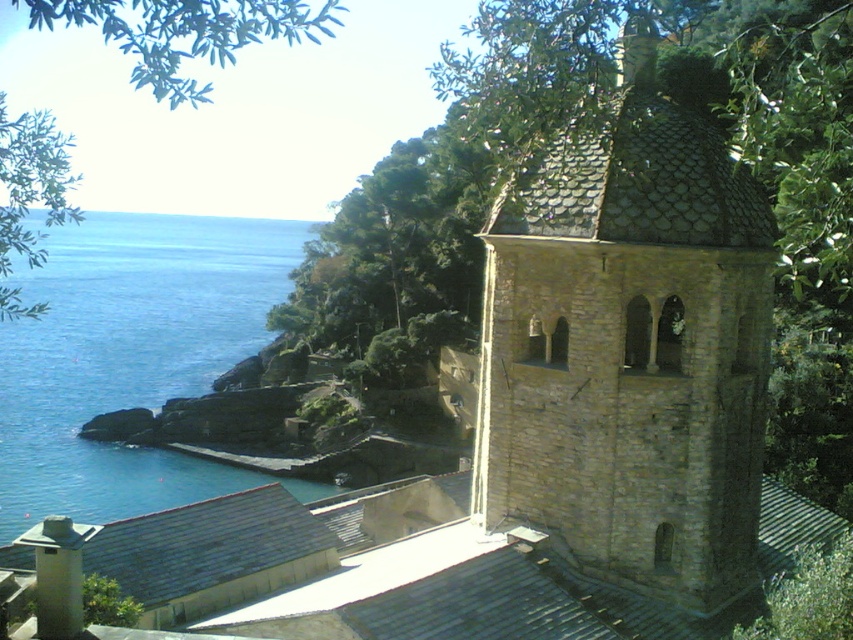
Question: In this image, where is brown stone church tower at center located relative to blue water at lower left?

Choices:
 (A) above
 (B) below

Answer: (B)

Question: Does brown stone church tower at center come behind blue water at lower left?

Choices:
 (A) yes
 (B) no

Answer: (B)

Question: From the image, what is the correct spatial relationship of brown stone church tower at center in relation to blue water at lower left?

Choices:
 (A) below
 (B) above

Answer: (A)